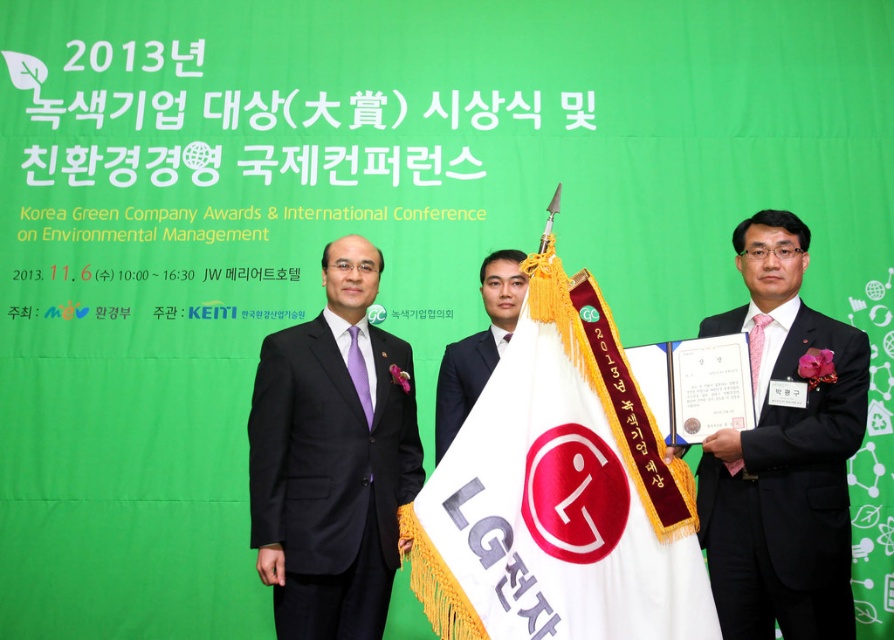
You are a photographer at the 2013 Korea Green Company Awards. You need to take a group photo of the two people in the black suit at center and dark gray suit at right. The camera you have can capture a maximum distance of 5 meters between subjects. Will you be able to capture both subjects in the same frame without moving the camera?

The distance between the black suit at center and dark gray suit at right is 5.49 meters, which exceeds the camera maximum capture distance of 5 meters. Therefore, the photographer cannot capture both subjects in the same frame without moving the camera.

You are attending the 2013 Korea Green Company Awards and notice two people in the front row. One is wearing a dark gray suit at right and the other a smooth black suit at center. Which person is closer to the stage?

The dark gray suit at right is closer to the stage because it is in front of the smooth black suit at center.

You are attending the 2013 Korea Green Company Awards and see two people in the dark gray suit at right and the smooth black suit at center. Which person is standing lower in the image?

The dark gray suit at right is below the smooth black suit at center, so the person in the dark gray suit at right is standing lower in the image.